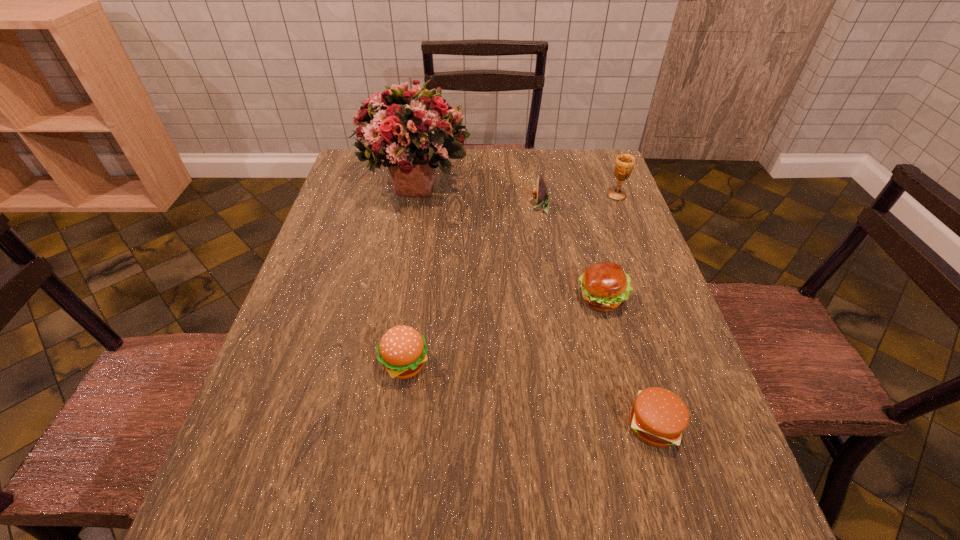
Identify the location of the second closest hamburger to the chalice. Image resolution: width=960 pixels, height=540 pixels. click(658, 417).

At what (x,y) coordinates should I click in order to perform the action: click on blank space that satisfies the following two spatial constraints: 1. on the front side of the fourth farthest object; 2. on the left side of the bouquet. Please return your answer as a coordinate pair (x, y). Looking at the image, I should click on (395, 299).

You are a GUI agent. You are given a task and a screenshot of the screen. Output one action in this format:
    pyautogui.click(x=<x>, y=<y>)
    Task: Click on the vacant space that satisfies the following two spatial constraints: 1. on the front side of the chalice; 2. on the seed side of the fourth object from right to left
    Image resolution: width=960 pixels, height=540 pixels.
    Given the screenshot: What is the action you would take?
    pyautogui.click(x=621, y=207)

Where is `blank space that satisfies the following two spatial constraints: 1. on the seed side of the shortest hamburger; 2. on the right side of the third object from left to right`? Image resolution: width=960 pixels, height=540 pixels. blank space that satisfies the following two spatial constraints: 1. on the seed side of the shortest hamburger; 2. on the right side of the third object from left to right is located at coordinates (574, 425).

Locate an element on the screen. The width and height of the screenshot is (960, 540). vacant space that satisfies the following two spatial constraints: 1. on the seed side of the third object from left to right; 2. on the front side of the fifth farthest object is located at coordinates (564, 365).

Identify the location of free spot that satisfies the following two spatial constraints: 1. on the back side of the third nearest object; 2. on the right side of the chalice. click(574, 195).